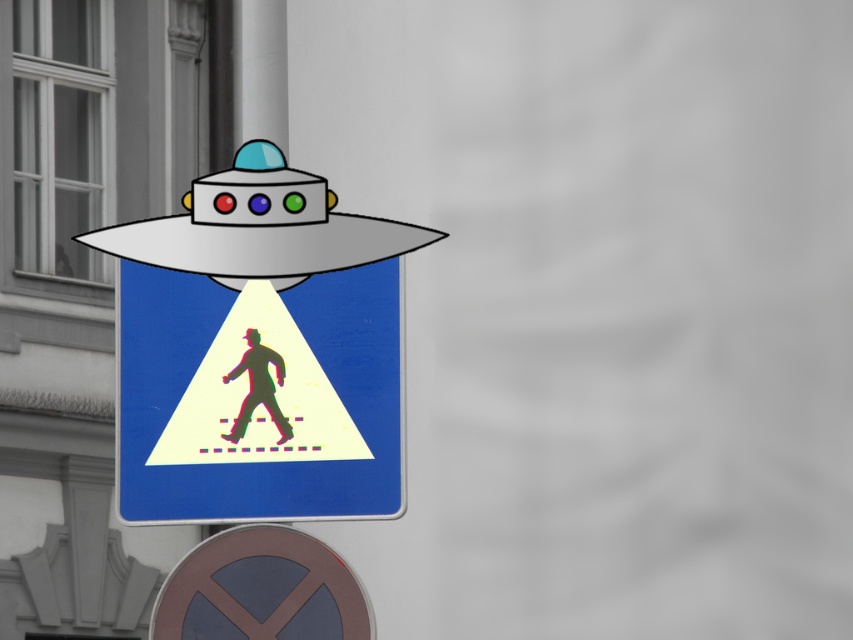
Who is taller, metallic pedestrian crossing sign at center or silhouette pedestrian at center?

metallic pedestrian crossing sign at center

Between metallic pedestrian crossing sign at center and silhouette pedestrian at center, which one is positioned higher?

silhouette pedestrian at center is higher up.

What do you see at coordinates (258, 396) in the screenshot? I see `metallic pedestrian crossing sign at center` at bounding box center [258, 396].

Where is `metallic pedestrian crossing sign at center`? The image size is (853, 640). metallic pedestrian crossing sign at center is located at coordinates (258, 396).

What do you see at coordinates (258, 396) in the screenshot? I see `metallic pedestrian crossing sign at center` at bounding box center [258, 396].

Can you confirm if metallic pedestrian crossing sign at center is thinner than metallic gray circle at lower center?

In fact, metallic pedestrian crossing sign at center might be wider than metallic gray circle at lower center.

Between point (117, 428) and point (184, 576), which one is positioned in front?

Point (184, 576) is in front.

The image size is (853, 640). What are the coordinates of `metallic pedestrian crossing sign at center` in the screenshot? It's located at (258, 396).

Is metallic gray circle at lower center smaller than silhouette pedestrian at center?

No.

Which is more to the left, metallic gray circle at lower center or silhouette pedestrian at center?

silhouette pedestrian at center

Is point (167, 625) positioned before point (256, 358)?

Yes, it is in front of point (256, 358).

Find the location of a particular element. metallic gray circle at lower center is located at coordinates (260, 589).